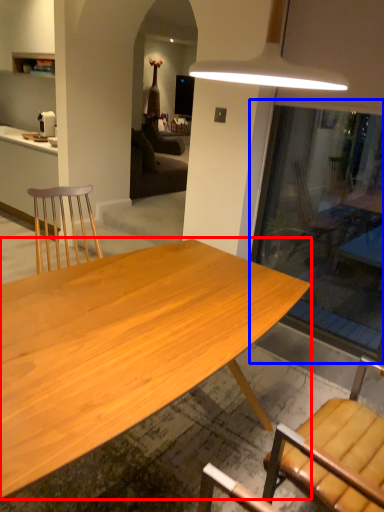
Question: Which of the following is the closest to the observer, desk (highlighted by a red box) or glass door (highlighted by a blue box)?

Choices:
 (A) desk
 (B) glass door

Answer: (A)